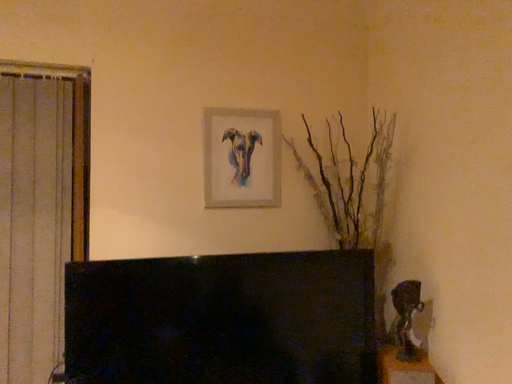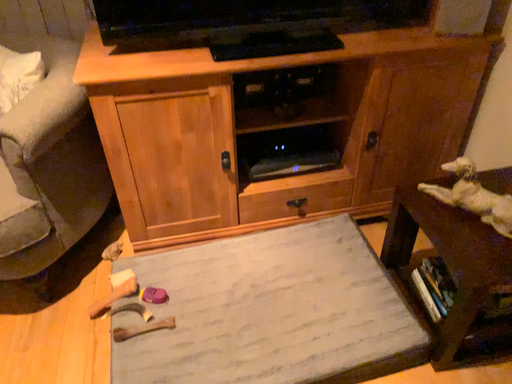
Question: How did the camera likely rotate when shooting the video?

Choices:
 (A) rotated downward
 (B) rotated upward

Answer: (A)